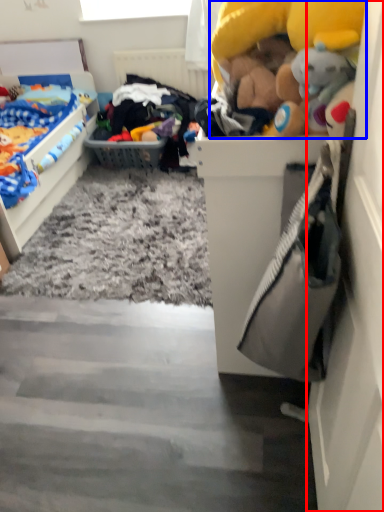
Question: Which point is closer to the camera, door (highlighted by a red box) or toy (highlighted by a blue box)?

Choices:
 (A) door
 (B) toy

Answer: (A)